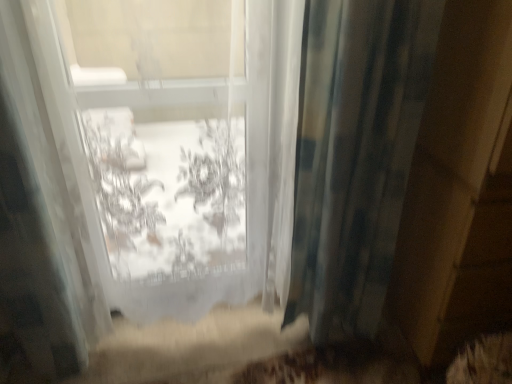
Image resolution: width=512 pixels, height=384 pixels. What do you see at coordinates (173, 150) in the screenshot?
I see `transparent fabric at center` at bounding box center [173, 150].

What is the approximate height of transparent fabric at center?

It is 4.00 feet.

What are the coordinates of `transparent fabric at center` in the screenshot? It's located at (173, 150).

You are a GUI agent. You are given a task and a screenshot of the screen. Output one action in this format:
    pyautogui.click(x=<x>, y=<y>)
    Task: Click on the blue textured curtain at right
    The image size is (512, 384).
    Given the screenshot: What is the action you would take?
    pyautogui.click(x=355, y=155)

What is the approximate width of blue textured curtain at right?

6.55 inches.

This screenshot has height=384, width=512. What do you see at coordinates (355, 155) in the screenshot?
I see `blue textured curtain at right` at bounding box center [355, 155].

Locate an element on the screen. The image size is (512, 384). transparent fabric at center is located at coordinates (173, 150).

Considering the relative positions of blue textured curtain at right and transparent fabric at center in the image provided, is blue textured curtain at right to the left of transparent fabric at center from the viewer's perspective?

No.

Is blue textured curtain at right in front of transparent fabric at center?

No, blue textured curtain at right is further to the viewer.

Which is farther from the camera, (420, 12) or (207, 138)?

Point (207, 138)

From the image's perspective, who appears lower, blue textured curtain at right or transparent fabric at center?

blue textured curtain at right appears lower in the image.

From a real-world perspective, who is located higher, blue textured curtain at right or transparent fabric at center?

From a 3D spatial view, transparent fabric at center is above.

Looking at their sizes, would you say blue textured curtain at right is wider or thinner than transparent fabric at center?

Considering their sizes, blue textured curtain at right looks slimmer than transparent fabric at center.

Can you confirm if blue textured curtain at right is shorter than transparent fabric at center?

Indeed, blue textured curtain at right has a lesser height compared to transparent fabric at center.

Does blue textured curtain at right have a smaller size compared to transparent fabric at center?

Indeed, blue textured curtain at right has a smaller size compared to transparent fabric at center.

Is blue textured curtain at right spatially inside transparent fabric at center, or outside of it?

blue textured curtain at right is not enclosed by transparent fabric at center.

Is blue textured curtain at right far from transparent fabric at center?

No, blue textured curtain at right is not far from transparent fabric at center.

Is blue textured curtain at right facing towards transparent fabric at center?

No.

The height and width of the screenshot is (384, 512). Identify the location of bay window that is above the blue textured curtain at right (from a real-world perspective). (173, 150).

Considering the relative positions of transparent fabric at center and blue textured curtain at right in the image provided, is transparent fabric at center to the right of blue textured curtain at right from the viewer's perspective?

No.

Is the depth of transparent fabric at center less than that of blue textured curtain at right?

Yes, the depth of transparent fabric at center is less than that of blue textured curtain at right.

Which is nearer, (231, 254) or (352, 273)?

Point (231, 254) is positioned closer to the camera compared to point (352, 273).

From the image's perspective, is transparent fabric at center located beneath blue textured curtain at right?

No, from the image's perspective, transparent fabric at center is not beneath blue textured curtain at right.

From a real-world perspective, who is located lower, transparent fabric at center or blue textured curtain at right?

In real-world perspective, blue textured curtain at right is lower.

Considering the relative sizes of transparent fabric at center and blue textured curtain at right in the image provided, is transparent fabric at center thinner than blue textured curtain at right?

No, transparent fabric at center is not thinner than blue textured curtain at right.

Which of these two, transparent fabric at center or blue textured curtain at right, stands taller?

With more height is transparent fabric at center.

Considering the relative sizes of transparent fabric at center and blue textured curtain at right in the image provided, is transparent fabric at center bigger than blue textured curtain at right?

Yes, transparent fabric at center is bigger than blue textured curtain at right.

Can we say transparent fabric at center lies outside blue textured curtain at right?

Absolutely, transparent fabric at center is external to blue textured curtain at right.

Would you say transparent fabric at center is a long distance from blue textured curtain at right?

No, transparent fabric at center is in close proximity to blue textured curtain at right.

Looking at this image, is transparent fabric at center facing away from blue textured curtain at right?

No, transparent fabric at center's orientation is not away from blue textured curtain at right.

You are a GUI agent. You are given a task and a screenshot of the screen. Output one action in this format:
    pyautogui.click(x=<x>, y=<y>)
    Task: Click on the bay window in front of the blue textured curtain at right
    The height and width of the screenshot is (384, 512).
    Given the screenshot: What is the action you would take?
    pyautogui.click(x=173, y=150)

You are a GUI agent. You are given a task and a screenshot of the screen. Output one action in this format:
    pyautogui.click(x=<x>, y=<y>)
    Task: Click on the curtain on the right of transparent fabric at center
    This screenshot has height=384, width=512.
    Given the screenshot: What is the action you would take?
    click(355, 155)

In the image, there is a transparent fabric at center. Identify the location of curtain below it (from a real-world perspective). Image resolution: width=512 pixels, height=384 pixels. coord(355,155).